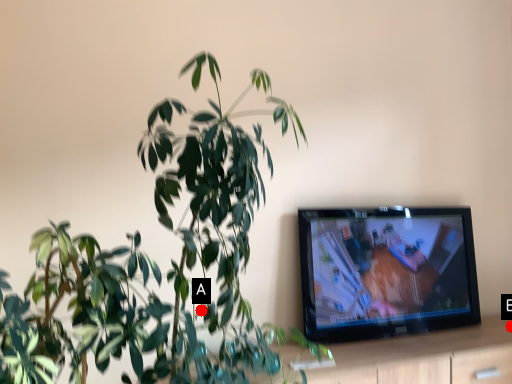
Question: Two points are circled on the image, labeled by A and B beside each circle. Which point is farther to the camera?

Choices:
 (A) A is further
 (B) B is further

Answer: (B)